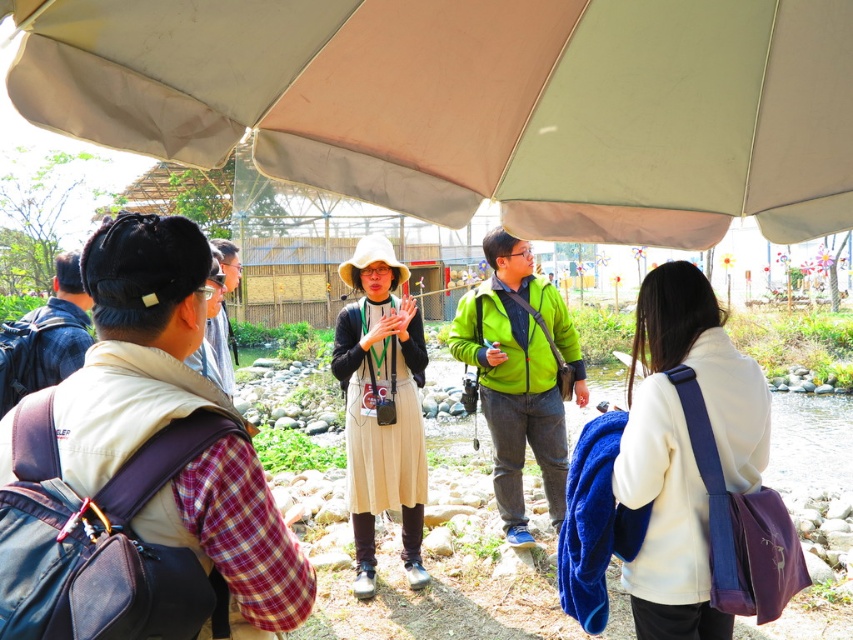
Who is higher up, beige fabric canopy at upper center or plaid fabric shirt at left?

Positioned higher is beige fabric canopy at upper center.

Is point (154, 58) positioned behind point (100, 480)?

That is True.

At what (x,y) coordinates should I click in order to perform the action: click on beige fabric canopy at upper center. Please return your answer as a coordinate pair (x, y). Looking at the image, I should click on (477, 104).

Which of these two, green fleece jacket at center or beige fabric dress at center, stands taller?

beige fabric dress at center is taller.

How distant is green fleece jacket at center from beige fabric dress at center?

green fleece jacket at center and beige fabric dress at center are 27.85 inches apart from each other.

Measure the distance between point (486, 371) and camera.

Point (486, 371) is 15.71 feet from camera.

At what (x,y) coordinates should I click in order to perform the action: click on green fleece jacket at center. Please return your answer as a coordinate pair (x, y). Looking at the image, I should click on (520, 374).

Who is positioned more to the right, purple fabric bag at lower right or green fleece jacket at center?

From the viewer's perspective, purple fabric bag at lower right appears more on the right side.

Is purple fabric bag at lower right wider than green fleece jacket at center?

No, purple fabric bag at lower right is not wider than green fleece jacket at center.

Between point (648, 378) and point (500, 404), which one is positioned in front?

Point (648, 378) is more forward.

The image size is (853, 640). Identify the location of purple fabric bag at lower right. (683, 451).